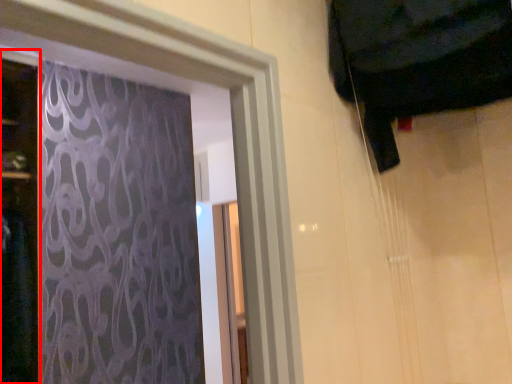
Question: From the image's perspective, considering the relative positions of door (annotated by the red box) and curtain in the image provided, where is door (annotated by the red box) located with respect to the staircase?

Choices:
 (A) above
 (B) below

Answer: (B)